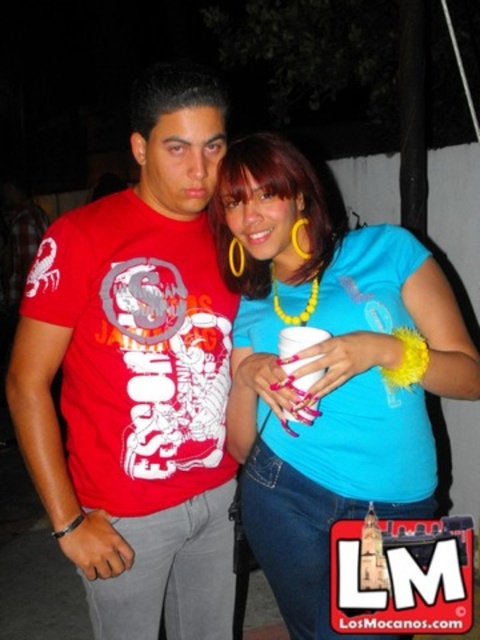
Does matte red t-shirt at left have a smaller size compared to blue fabric shirt at center?

No, matte red t-shirt at left is not smaller than blue fabric shirt at center.

Can you confirm if matte red t-shirt at left is positioned above blue fabric shirt at center?

No, matte red t-shirt at left is not above blue fabric shirt at center.

Find the location of `matte red t-shirt at left`. matte red t-shirt at left is located at coordinates (137, 378).